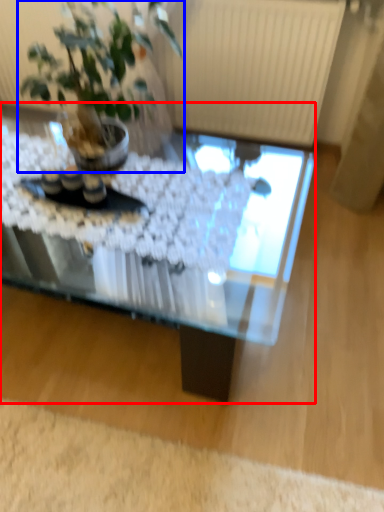
Question: Which object appears closest to the camera in this image, coffee table (highlighted by a red box) or houseplant (highlighted by a blue box)?

Choices:
 (A) coffee table
 (B) houseplant

Answer: (B)